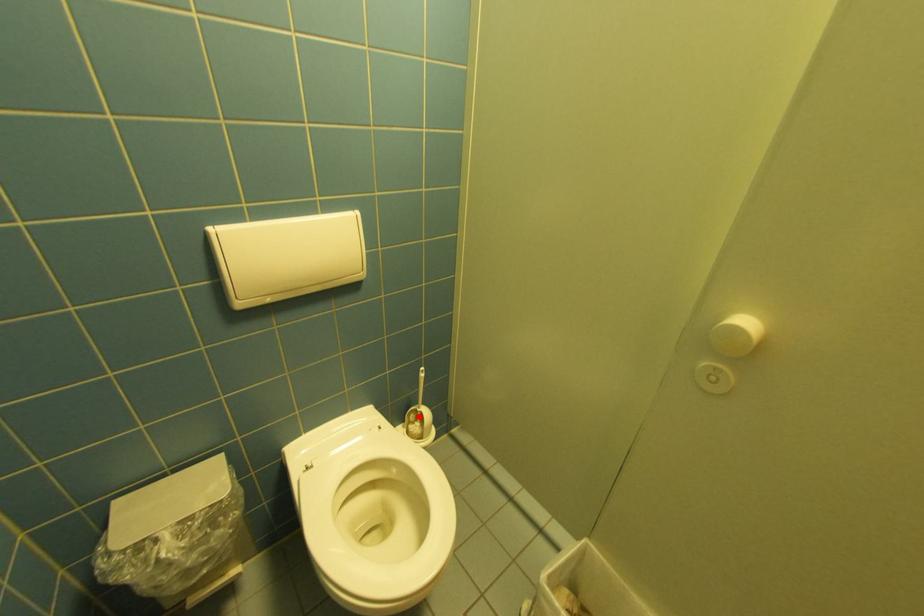
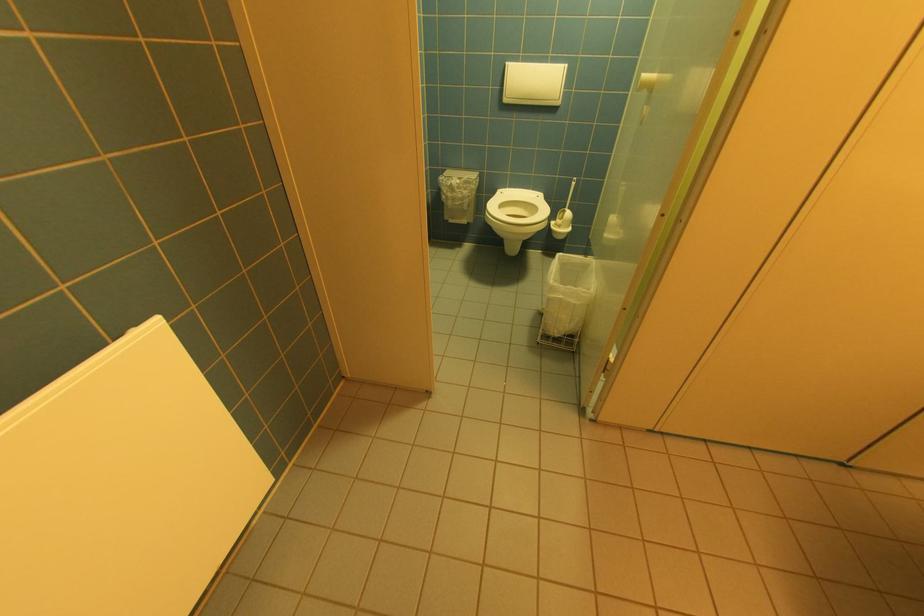
Question: I am providing you with two images of the same scene from different viewpoints. In image1, a red point is highlighted. Considering the same 3D point in image2, which of the following is correct?

Choices:
 (A) It is closer
 (B) It is farther

Answer: (A)